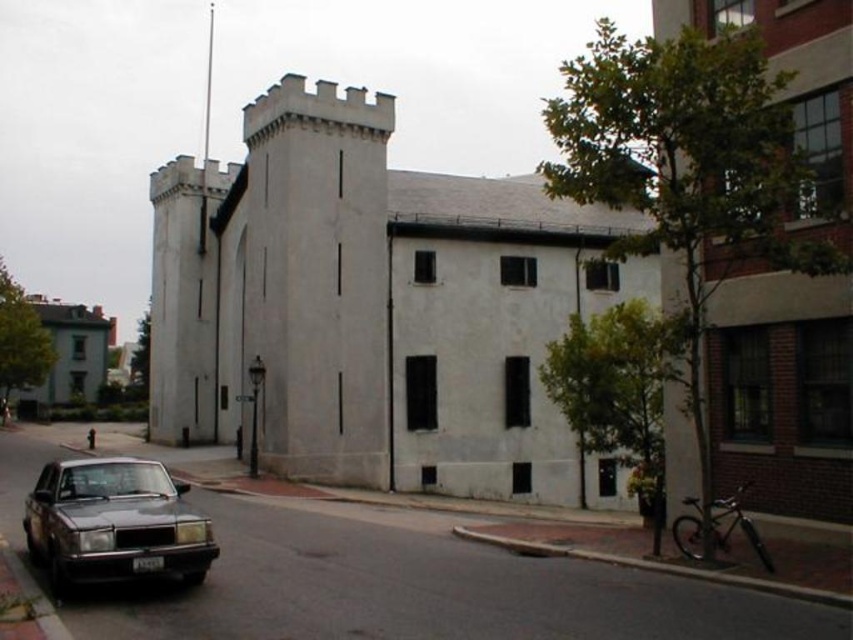
Which is behind, point (384, 429) or point (178, 566)?

The point (384, 429) is behind.

Between white smooth stone castle at center and shiny dark gray sedan at lower left, which one is positioned higher?

Positioned higher is white smooth stone castle at center.

Measure the distance between point (326, 362) and camera.

Point (326, 362) is 26.58 meters away from camera.

Identify the location of white smooth stone castle at center. (370, 305).